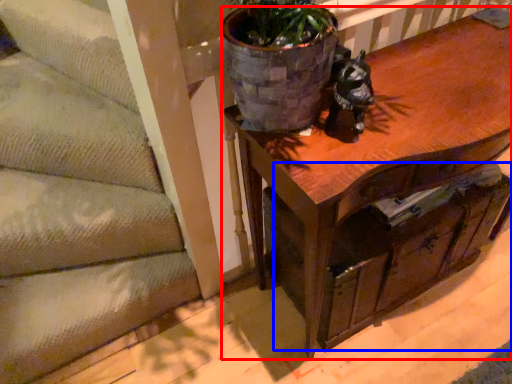
Question: Which of the following is the farthest to the observer, table (highlighted by a red box) or drawer (highlighted by a blue box)?

Choices:
 (A) table
 (B) drawer

Answer: (B)